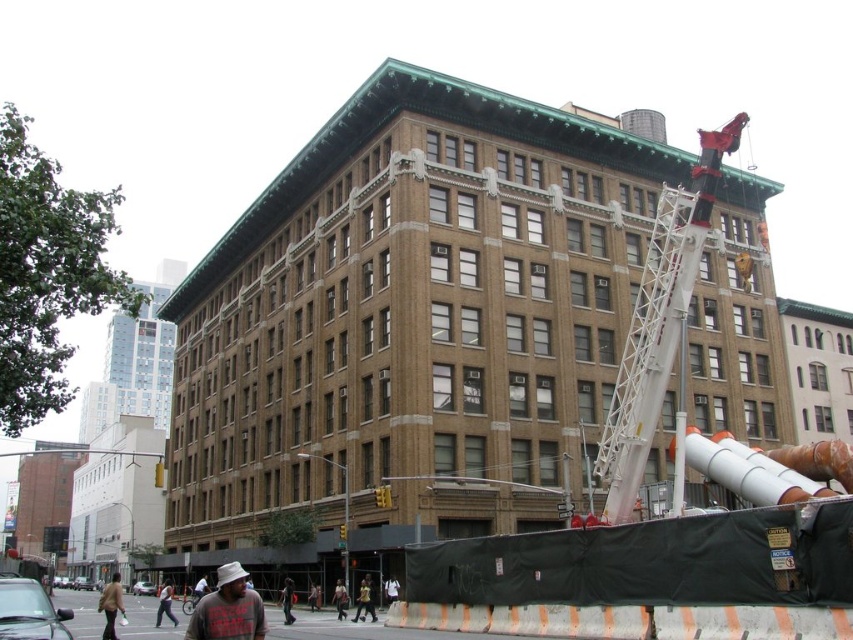
You are a construction worker who just arrived at the site. You see the white metallic crane at right and the gray cotton hat at lower left. Which object is bigger in size?

The white metallic crane at right is larger in size compared to the gray cotton hat at lower left according to the description.

You are a delivery driver who needs to park your truck near the white metallic crane at right. The parking spot you found is at point 0.503, 0.773. Is this parking spot directly under the crane?

The white metallic crane at right is positioned at point (659, 321), so the parking spot at that coordinate is directly under the crane.

You are a construction worker standing at the center of the scene. You need to move your equipment from the white metallic crane at right to the brown leather jacket at lower left. Which object is taller, and will this affect your ability to move the equipment?

The white metallic crane at right is not as tall as the brown leather jacket at lower left. However, since the crane is part of the construction site and the jacket is an object at the lower left, the height difference may not directly impact moving equipment between them unless there are specific clearance requirements. The jacket itself is likely not an obstruction, so the equipment can be moved as long as other pathways are clear.